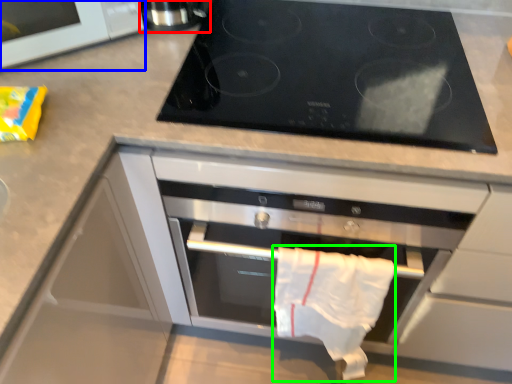
Question: Which is farther away from appliance (highlighted by a red box)? microwave (highlighted by a blue box) or cloth (highlighted by a green box)?

Choices:
 (A) microwave
 (B) cloth

Answer: (B)